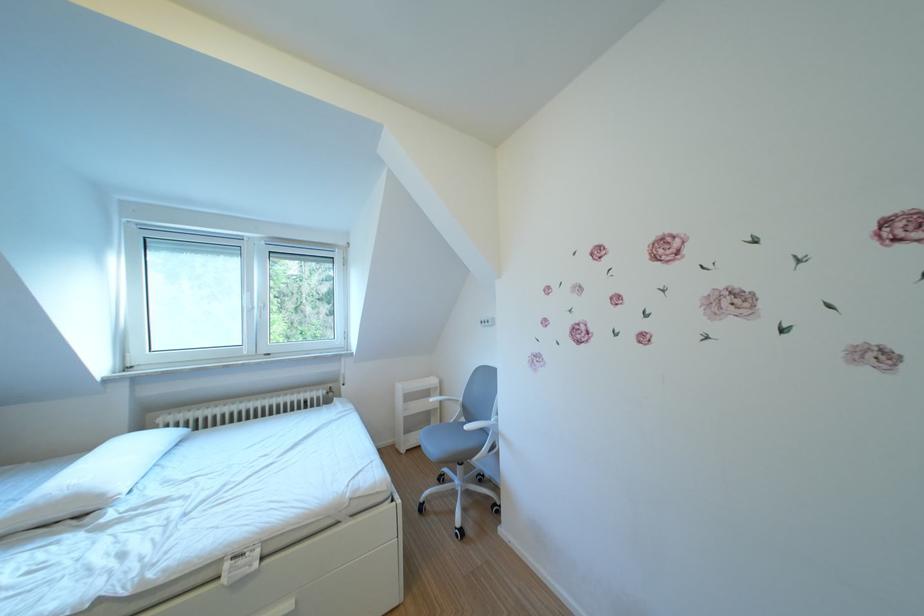
This screenshot has height=616, width=924. Describe the element at coordinates (256, 310) in the screenshot. I see `a white window handle` at that location.